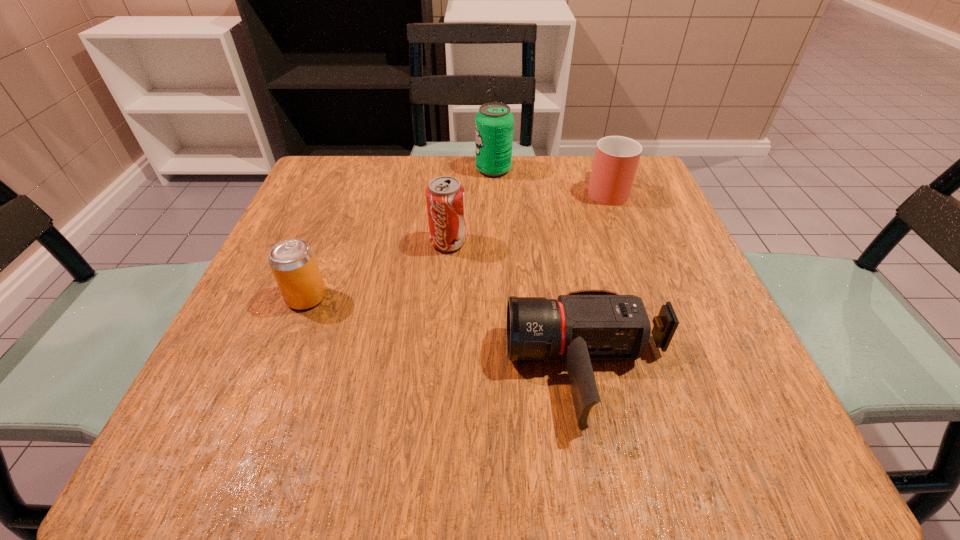
Where is `blank space at the near right corner`? The image size is (960, 540). blank space at the near right corner is located at coordinates (667, 430).

Identify the location of unoccupied area between the rightmost pop (soda) and the leftmost pop (soda). (400, 233).

At what (x,y) coordinates should I click in order to perform the action: click on free space between the leftmost object and the camcorder. Please return your answer as a coordinate pair (x, y). This screenshot has height=540, width=960. Looking at the image, I should click on (448, 333).

Locate an element on the screen. vacant area that lies between the second pop (soda) from right to left and the leftmost pop (soda) is located at coordinates (377, 270).

In order to click on free space that is in between the nearest object and the nearest pop (soda) in this screenshot , I will do `click(448, 333)`.

The height and width of the screenshot is (540, 960). I want to click on vacant space that is in between the camcorder and the farthest pop (soda), so click(x=541, y=269).

Locate an element on the screen. free space between the shortest pop (soda) and the third farthest object is located at coordinates (377, 270).

Find the location of a particular element. the second closest object to the cup is located at coordinates (445, 196).

Find the location of `object that is the fourth closest one to the leftmost pop (soda)`. object that is the fourth closest one to the leftmost pop (soda) is located at coordinates (616, 160).

Locate which pop (soda) is the closest to the second object from left to right. Please provide its 2D coordinates. Your answer should be formatted as a tuple, i.e. [(x, y)], where the tuple contains the x and y coordinates of a point satisfying the conditions above.

[(293, 263)]